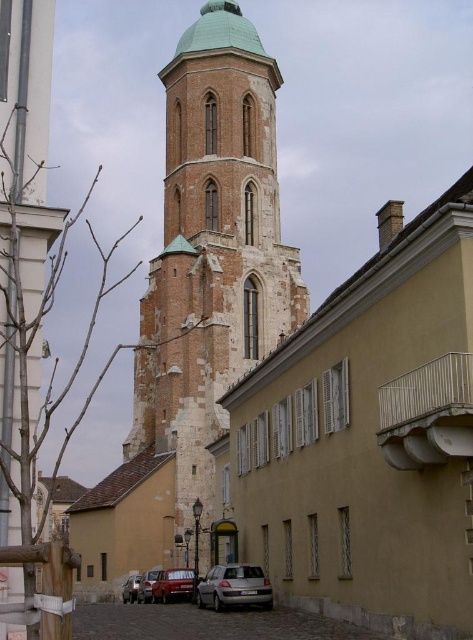
Can you confirm if brown brick tower at center is shorter than matte red car at center?

Incorrect, brown brick tower at center's height does not fall short of matte red car at center's.

Who is shorter, brown brick tower at center or matte red car at center?

matte red car at center is shorter.

What do you see at coordinates (212, 250) in the screenshot?
I see `brown brick tower at center` at bounding box center [212, 250].

Where is `brown brick tower at center`? The width and height of the screenshot is (473, 640). brown brick tower at center is located at coordinates pos(212,250).

Which is more to the right, brown brick tower at center or silver metallic car at lower center?

Positioned to the right is silver metallic car at lower center.

Who is lower down, brown brick tower at center or silver metallic car at lower center?

Positioned lower is silver metallic car at lower center.

Who is more distant from viewer, (254, 112) or (254, 593)?

The point (254, 112) is behind.

The height and width of the screenshot is (640, 473). In order to click on brown brick tower at center in this screenshot , I will do `click(212, 250)`.

Is brown brick tower at center below shiny silver car at lower left?

No.

Where is `brown brick tower at center`? This screenshot has width=473, height=640. brown brick tower at center is located at coordinates (212, 250).

At what (x,y) coordinates should I click in order to perform the action: click on brown brick tower at center. Please return your answer as a coordinate pair (x, y). This screenshot has width=473, height=640. Looking at the image, I should click on (212, 250).